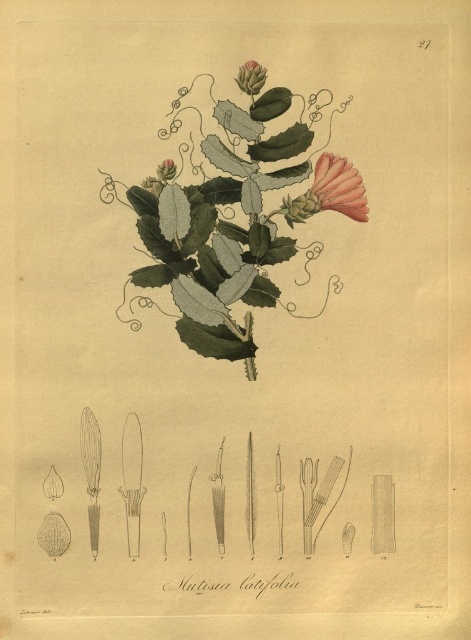
Question: Does green glossy leaves at center appear over green matte flower at upper center?

Choices:
 (A) no
 (B) yes

Answer: (A)

Question: Which point appears farthest from the camera in this image?

Choices:
 (A) (349, 196)
 (B) (313, 195)

Answer: (B)

Question: Based on their relative distances, which object is farther from the green matte flower at upper center?

Choices:
 (A) green glossy leaves at center
 (B) pink matte flower at upper right
 (C) green matte leaf at upper center

Answer: (A)

Question: Which of the following is the closest to the observer?

Choices:
 (A) green matte leaf at upper center
 (B) pink matte flower at upper right

Answer: (A)

Question: Can you confirm if green glossy leaves at center is positioned below green matte flower at upper center?

Choices:
 (A) yes
 (B) no

Answer: (A)

Question: Does green matte flower at upper center have a lesser width compared to green matte leaf at upper center?

Choices:
 (A) no
 (B) yes

Answer: (A)